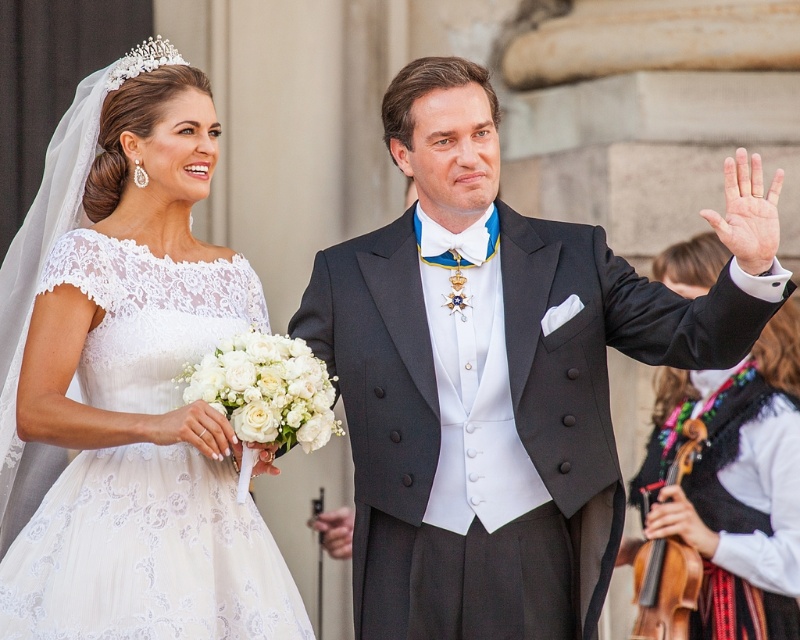
Describe the element at coordinates (132, 388) in the screenshot. I see `white lace dress at upper left` at that location.

Does white lace dress at upper left appear on the right side of black knit vest at right?

No, white lace dress at upper left is not to the right of black knit vest at right.

The width and height of the screenshot is (800, 640). Describe the element at coordinates (132, 388) in the screenshot. I see `white lace dress at upper left` at that location.

Find the location of a particular element. Image resolution: width=800 pixels, height=640 pixels. white lace dress at upper left is located at coordinates [x=132, y=388].

Who is more forward, (768, 577) or (174, 54)?

Positioned in front is point (174, 54).

Who is more distant from viewer, (784, 509) or (110, 83)?

Positioned behind is point (784, 509).

The height and width of the screenshot is (640, 800). In order to click on black knit vest at right in this screenshot , I will do `click(734, 500)`.

Where is `black knit vest at right`? This screenshot has width=800, height=640. black knit vest at right is located at coordinates (734, 500).

Between matte black suit at center and black knit vest at right, which one has more height?

matte black suit at center

Which of these two, matte black suit at center or black knit vest at right, stands shorter?

black knit vest at right

Who is more forward, (380,228) or (632,556)?

Point (632,556) is more forward.

Where is `matte black suit at center`? matte black suit at center is located at coordinates (500, 378).